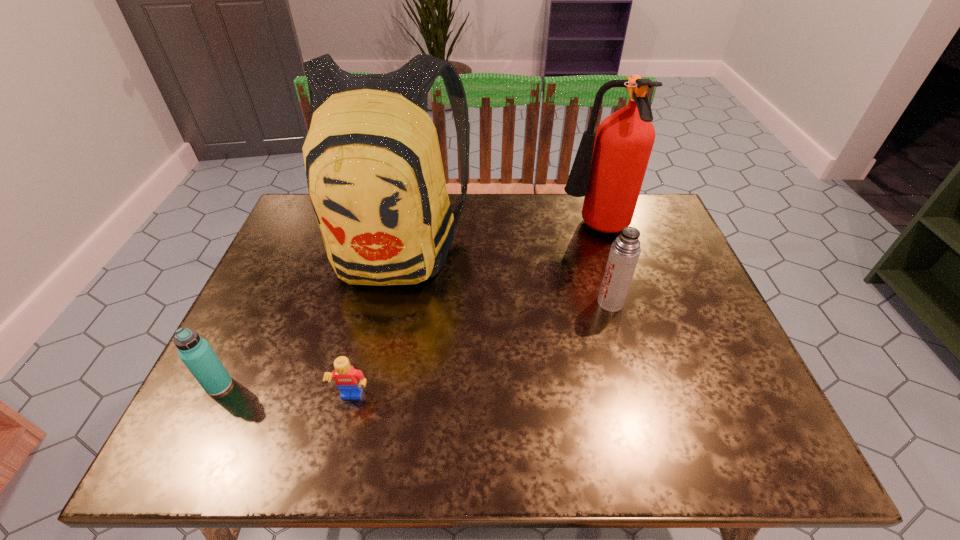
Identify the location of free space between the third tallest object and the shortest object. (481, 350).

At what (x,y) coordinates should I click in order to perform the action: click on free space between the shorter thermos bottle and the shortest object. Please return your answer as a coordinate pair (x, y). This screenshot has height=540, width=960. Looking at the image, I should click on (286, 392).

At what (x,y) coordinates should I click in order to perform the action: click on free space between the fire extinguisher and the Lego. Please return your answer as a coordinate pair (x, y). The width and height of the screenshot is (960, 540). Looking at the image, I should click on (473, 314).

In order to click on blank region between the fire extinguisher and the backpack in this screenshot , I will do `click(495, 238)`.

You are a GUI agent. You are given a task and a screenshot of the screen. Output one action in this format:
    pyautogui.click(x=<x>, y=<y>)
    Task: Click on the vacant region between the taller thermos bottle and the Lego
    The image size is (960, 540).
    Given the screenshot: What is the action you would take?
    click(x=481, y=350)

In order to click on free space between the shortest object and the right thermos bottle in this screenshot , I will do `click(481, 350)`.

Locate which object is the third closest to the left thermos bottle. Please provide its 2D coordinates. Your answer should be formatted as a tuple, i.e. [(x, y)], where the tuple contains the x and y coordinates of a point satisfying the conditions above.

[(625, 250)]

This screenshot has width=960, height=540. Identify the location of object that is the third closest one to the left thermos bottle. (625, 250).

What are the coordinates of `free space that satisfies the following two spatial constraints: 1. on the back side of the third tallest object; 2. on the left side of the nearer thermos bottle` in the screenshot? It's located at (260, 302).

Where is `free spot that satisfies the following two spatial constraints: 1. at the nozzle of the fire extinguisher; 2. on the face of the Lego`? Image resolution: width=960 pixels, height=540 pixels. free spot that satisfies the following two spatial constraints: 1. at the nozzle of the fire extinguisher; 2. on the face of the Lego is located at coordinates (646, 398).